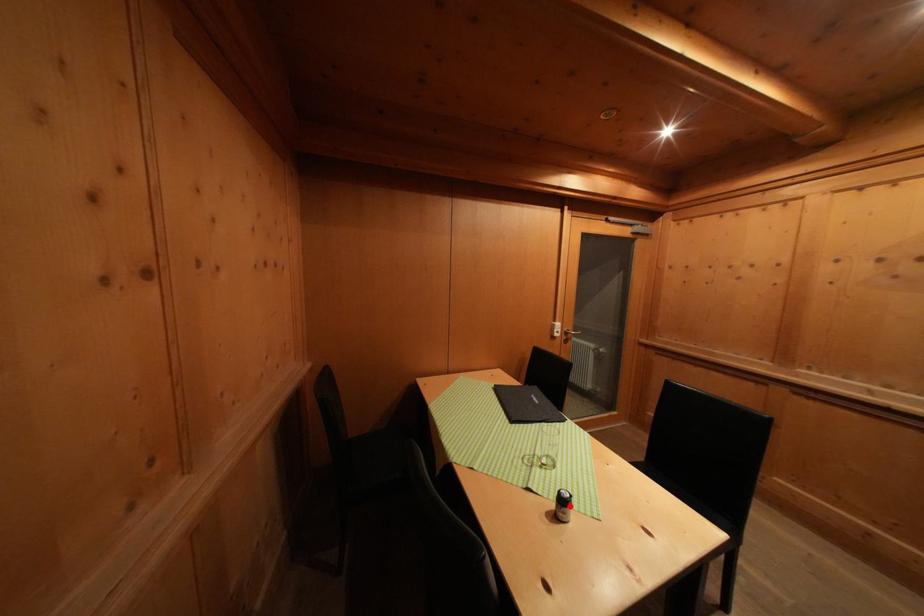
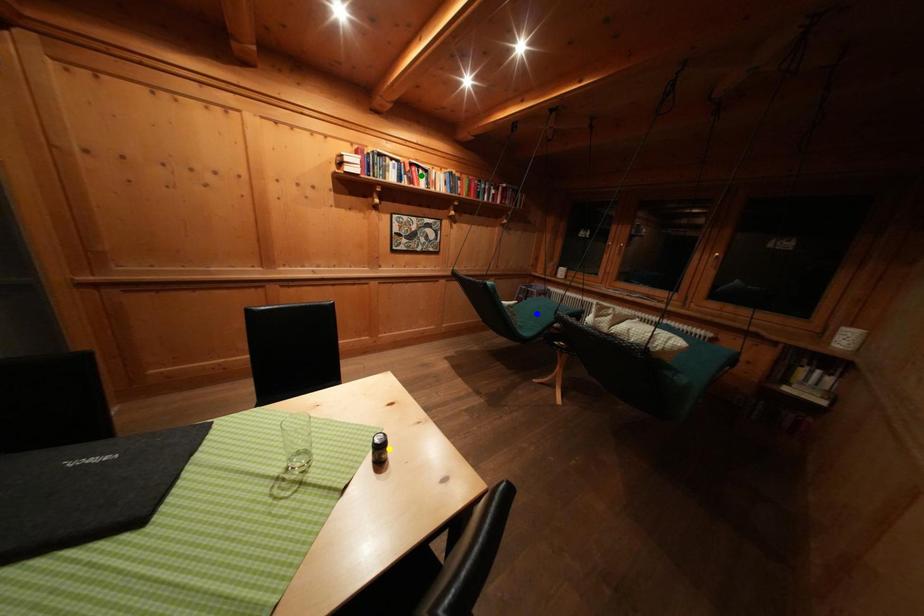
Question: I am providing you with two images of the same scene from different viewpoints. A red point is marked on the first image. You are given multiple points on the second image. Which spot in image 2 lines up with the point in image 1?

Choices:
 (A) green point
 (B) yellow point
 (C) blue point

Answer: (B)